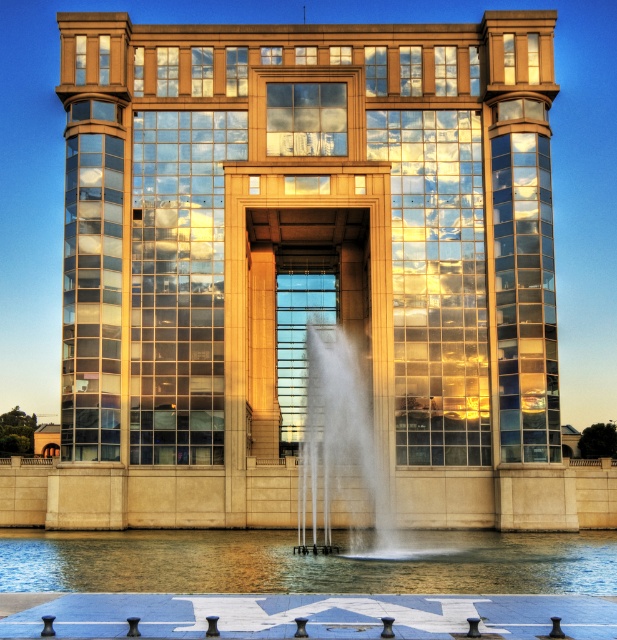
You are standing in front of the building and want to walk from the clear glass water at lower center to the white frothy water at center. Which path would require stepping on a wider area of water?

The clear glass water at lower center has a larger width than the white frothy water at center, so stepping on the path to the white frothy water at center would require crossing a narrower area of water, while the clear glass water at lower center offers a wider path.

You are standing in front of the building and want to take a photo of the water feature. The clear glass water at lower center and the white frothy water at center are both in your view. Which part of the water feature is shorter?

The clear glass water at lower center has a lesser height compared to the white frothy water at center, so the clear glass water at lower center is shorter.

You are standing in front of the building and want to take a photo of the white frothy water at center without the clear glass water at lower center blocking the view. Is this possible?

The clear glass water at lower center is in front of the white frothy water at center, so you cannot take a photo of the white frothy water at center without the clear glass water at lower center blocking the view.